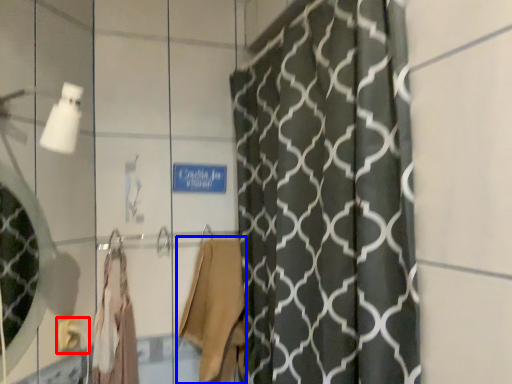
Question: Among these objects, which one is farthest to the camera, towel bar (highlighted by a red box) or robe (highlighted by a blue box)?

Choices:
 (A) towel bar
 (B) robe

Answer: (B)